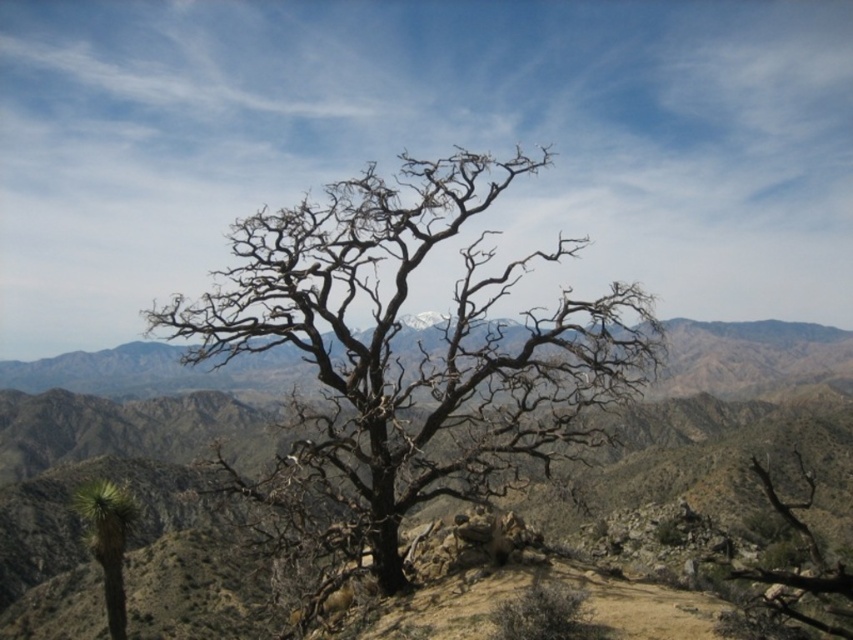
You are standing in the desert and see a prominent tree with intricate branches. There is a specific point at coordinates point (x=418, y=349). Can you determine whether this point is located on the tree or somewhere else in the scene?

The point (x=418, y=349) is on the brown dry bark tree at center, so the point is located on the tree.